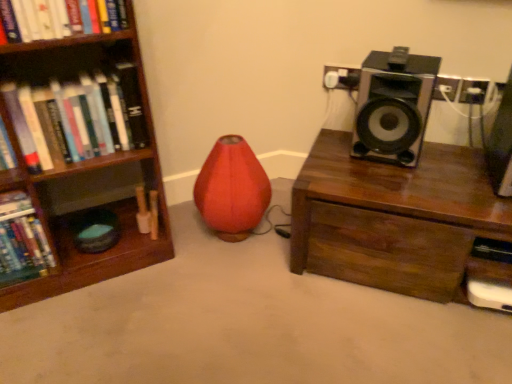
Question: Visually, is matte red bean bag chair at center positioned to the left or to the right of black plastic speaker at upper right, which ranks as the 1th speaker in left-to-right order?

Choices:
 (A) left
 (B) right

Answer: (A)

Question: Do you think matte red bean bag chair at center is within black plastic speaker at upper right, the second speaker from the right, or outside of it?

Choices:
 (A) inside
 (B) outside

Answer: (B)

Question: Estimate the real-world distances between objects in this image. Which object is closer to the hardcover book at left, positioned as the second book in left-to-right order?

Choices:
 (A) metallic silver speaker at upper right, which ranks as the 2th speaker in left-to-right order
 (B) black plastic speaker at upper right, the second speaker from the right
 (C) matte red bean bag chair at center
 (D) hardcover book at left, the first book in the left-to-right sequence
 (E) brown wooden chest at right

Answer: (D)

Question: Which object is positioned farthest from the matte red bean bag chair at center?

Choices:
 (A) hardcover book at left, acting as the first book starting from the top
 (B) brown wooden chest at right
 (C) black plastic speaker at upper right, the second speaker from the right
 (D) hardcover book at left, the first book in the left-to-right sequence
 (E) metallic silver speaker at upper right, which ranks as the 2th speaker in left-to-right order

Answer: (E)